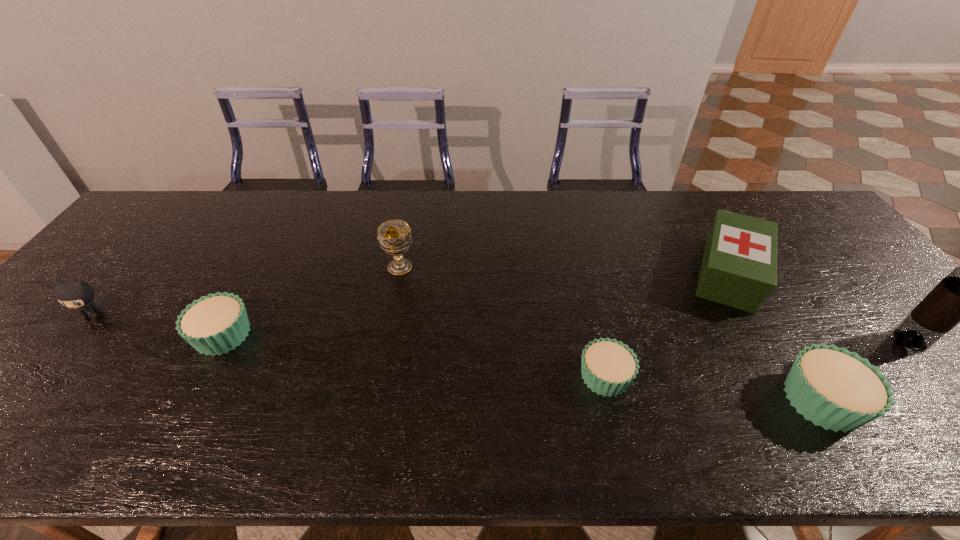
Identify the location of vacant region at the far edge of the desktop. The image size is (960, 540). (426, 231).

Where is `vacant space at the near edge of the desktop`? This screenshot has height=540, width=960. vacant space at the near edge of the desktop is located at coordinates (196, 407).

In the image, there is a desktop. Find the location of `free space at the left edge`. free space at the left edge is located at coordinates (132, 283).

Where is `vacant space at the right edge of the desktop`? This screenshot has height=540, width=960. vacant space at the right edge of the desktop is located at coordinates (792, 242).

The height and width of the screenshot is (540, 960). Find the location of `vacant space in between the rightmost cupcake and the first-aid kit`. vacant space in between the rightmost cupcake and the first-aid kit is located at coordinates (776, 337).

This screenshot has width=960, height=540. What are the coordinates of `free space that is in between the first-aid kit and the kitten` in the screenshot? It's located at (411, 294).

The image size is (960, 540). I want to click on empty space that is in between the rightmost object and the leftmost object, so click(x=501, y=327).

Locate an element on the screen. The image size is (960, 540). vacant point located between the second shortest object and the rightmost object is located at coordinates (566, 338).

Image resolution: width=960 pixels, height=540 pixels. Identify the location of empty location between the kitten and the second shortest cupcake. (157, 325).

Locate an element on the screen. The width and height of the screenshot is (960, 540). vacant space in between the rightmost cupcake and the sixth tallest object is located at coordinates (522, 367).